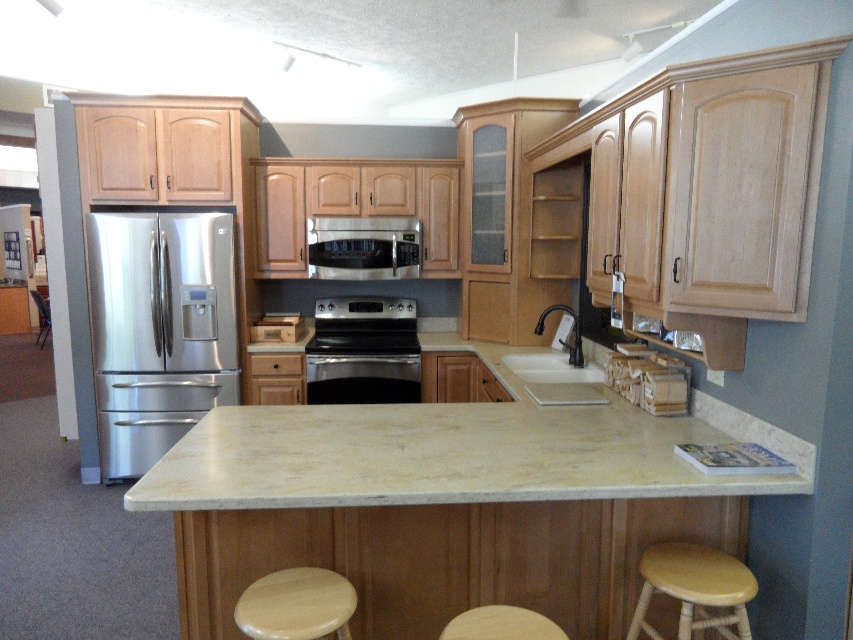
Question: Which object is farther from the camera taking this photo?

Choices:
 (A) light brown wood stool at lower center
 (B) beige marble countertop at center
 (C) stainless steel microwave at center
 (D) black stainless steel oven at center

Answer: (C)

Question: Is black stainless steel oven at center smaller than light wood bar stool at lower center?

Choices:
 (A) yes
 (B) no

Answer: (B)

Question: Among these points, which one is farthest from the camera?

Choices:
 (A) (663, 560)
 (B) (451, 620)

Answer: (B)

Question: Is stainless steel microwave at center wider than light wood bar stool at lower center?

Choices:
 (A) no
 (B) yes

Answer: (B)

Question: Based on their relative distances, which object is nearer to the black stainless steel oven at center?

Choices:
 (A) stainless steel refrigerator at left
 (B) beige marble countertop at center
 (C) stainless steel microwave at center
 (D) light wood/wooden stool at lower right

Answer: (C)

Question: Is stainless steel refrigerator at left to the left of light wood bar stool at lower center from the viewer's perspective?

Choices:
 (A) no
 (B) yes

Answer: (B)